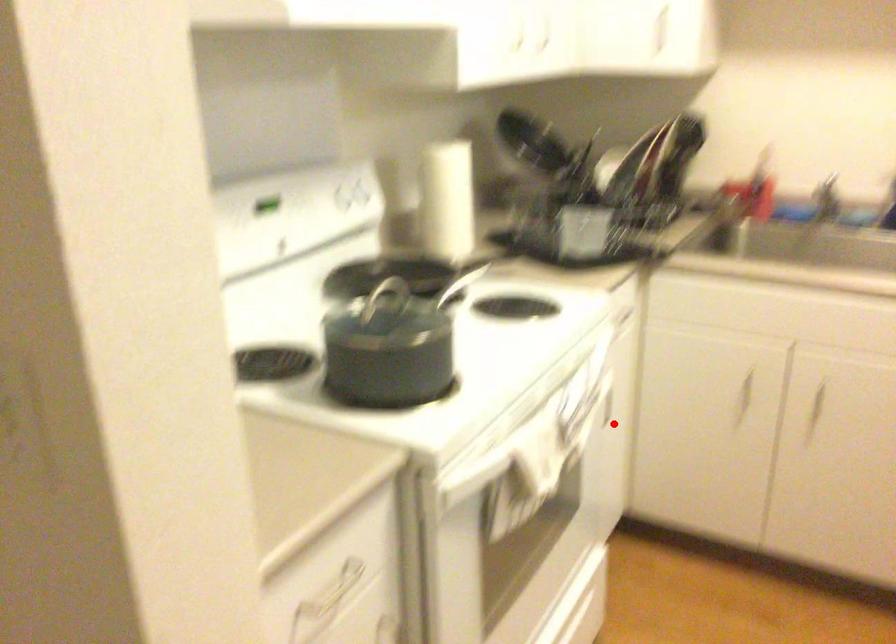
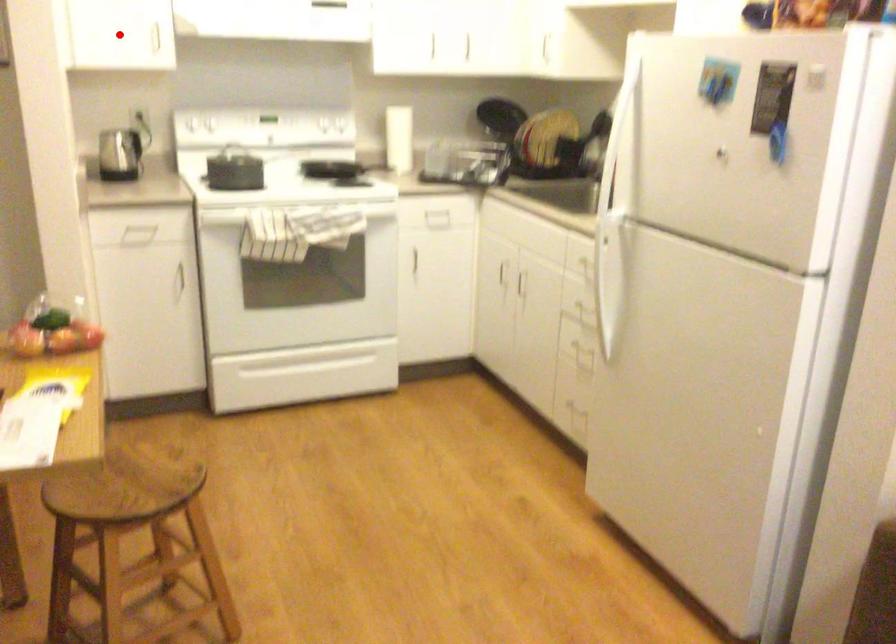
I am providing you with two images of the same scene from different viewpoints. A red point is marked on the first image and another point is marked on the second image. Is the red point in image1 aligned with the point shown in image2?

No